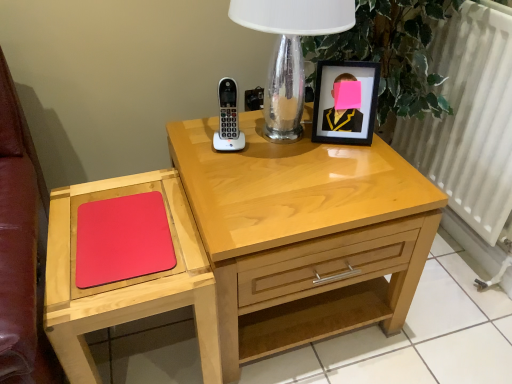
This screenshot has width=512, height=384. Find the location of `free point above matte wood mouse pad at left (from a real-world perspective)`. free point above matte wood mouse pad at left (from a real-world perspective) is located at coordinates (126, 230).